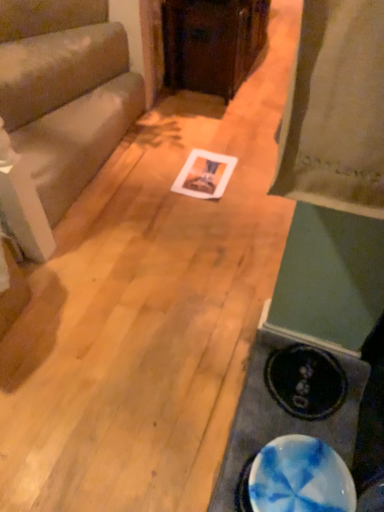
You are a GUI agent. You are given a task and a screenshot of the screen. Output one action in this format:
    pyautogui.click(x=<x>, y=<y>)
    Task: Click on the unoccupied space behind blue marble table at lower right
    This screenshot has width=384, height=512.
    Given the screenshot: What is the action you would take?
    pyautogui.click(x=217, y=308)